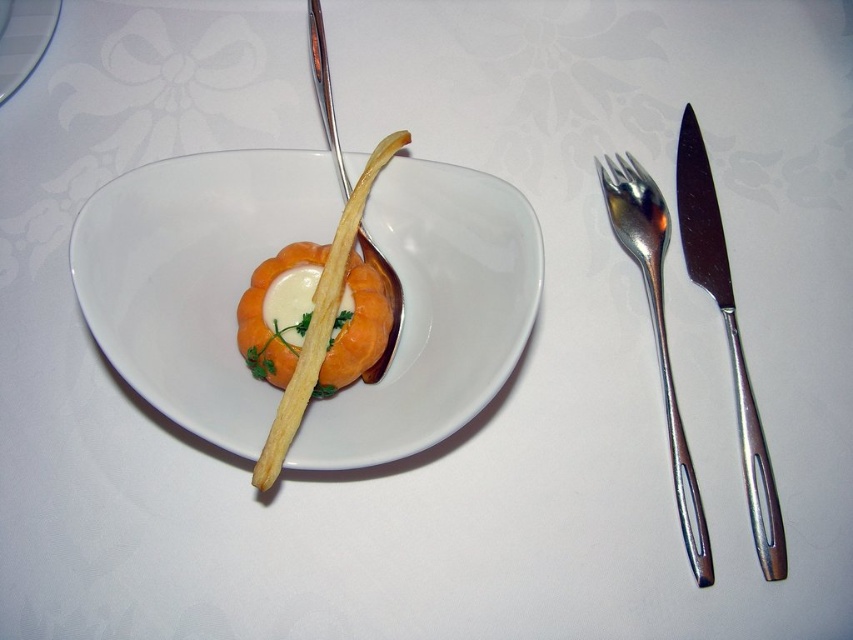
Question: Which of the following is the farthest from the observer?

Choices:
 (A) polished metal knife at right
 (B) orange matte salmon at center
 (C) white glossy bowl at center

Answer: (A)

Question: Estimate the real-world distances between objects in this image. Which object is closer to the white glossy bowl at center?

Choices:
 (A) polished metal knife at right
 (B) orange matte salmon at center

Answer: (B)

Question: Can you confirm if orange matte salmon at center is bigger than silver metallic fork at right?

Choices:
 (A) no
 (B) yes

Answer: (A)

Question: Can you confirm if white glossy bowl at center is positioned above white glossy plate at center?

Choices:
 (A) yes
 (B) no

Answer: (B)

Question: Is orange matte salmon at center bigger than silver metallic fork at right?

Choices:
 (A) no
 (B) yes

Answer: (A)

Question: Which point is farther to the camera?

Choices:
 (A) (738, 372)
 (B) (695, 513)
 (C) (18, 3)

Answer: (C)